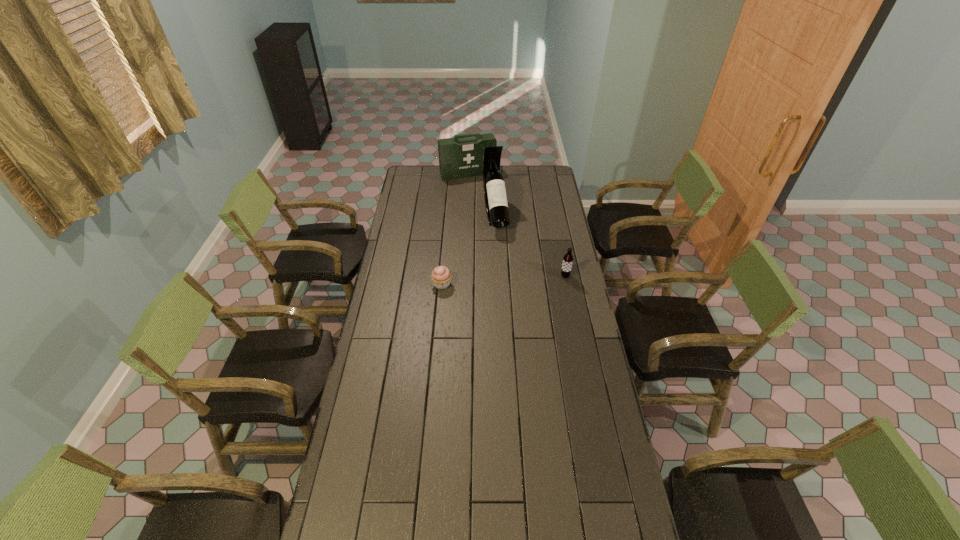
Find the location of a particular element. This screenshot has height=540, width=960. the shortest object is located at coordinates (441, 276).

Find the location of `root beer`. root beer is located at coordinates (567, 263).

Image resolution: width=960 pixels, height=540 pixels. Identify the location of the rightmost object. (567, 263).

Where is `the tallest object`? The image size is (960, 540). the tallest object is located at coordinates (495, 197).

At what (x,y) coordinates should I click in order to perform the action: click on wine bottle. Please return your answer as a coordinate pair (x, y). The image size is (960, 540). Looking at the image, I should click on (495, 197).

This screenshot has height=540, width=960. What are the coordinates of `the third shortest object` in the screenshot? It's located at (458, 158).

You are a GUI agent. You are given a task and a screenshot of the screen. Output one action in this format:
    pyautogui.click(x=<x>, y=<y>)
    Task: Click on the farthest object
    
    Given the screenshot: What is the action you would take?
    pyautogui.click(x=458, y=158)

Find the location of `vacant space located on the back of the shortest object`. vacant space located on the back of the shortest object is located at coordinates (445, 249).

Identify the location of free space located on the left of the rightmost object. (477, 276).

At what (x,y) coordinates should I click in order to perform the action: click on vacant space situated on the stand of the tallest object. Please return your answer as a coordinate pair (x, y). The image size is (960, 540). Looking at the image, I should click on (507, 273).